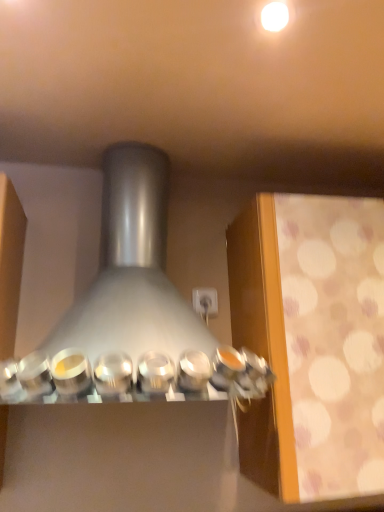
This screenshot has height=512, width=384. Identify the location of blank space above satin silver range hood at center (from a real-world perspective). (134, 119).